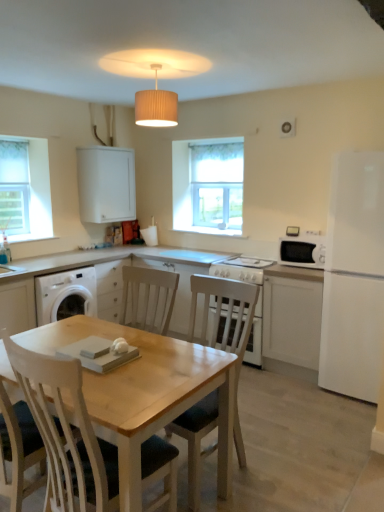
The width and height of the screenshot is (384, 512). Identify the location of unoccupied region to the right of light wood chair at center. (281, 467).